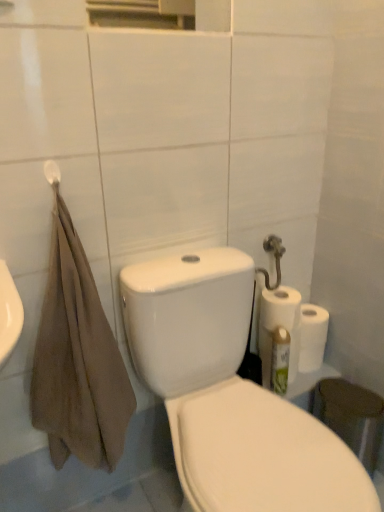
Question: Considering the positions of green matte cleaning product at right and white glossy porcelain at center in the image, is green matte cleaning product at right wider or thinner than white glossy porcelain at center?

Choices:
 (A) thin
 (B) wide

Answer: (A)

Question: From the image's perspective, relative to white glossy porcelain at center, is green matte cleaning product at right above or below?

Choices:
 (A) above
 (B) below

Answer: (A)

Question: Estimate the real-world distances between objects in this image. Which object is closer to the green matte cleaning product at right?

Choices:
 (A) brown cotton towel at left
 (B) white matte paper towel at right
 (C) white matte towel bar at upper left
 (D) white glossy porcelain at center

Answer: (B)

Question: Which object is the closest to the white matte paper towel at right?

Choices:
 (A) white glossy porcelain at center
 (B) white matte towel bar at upper left
 (C) green matte cleaning product at right
 (D) brown cotton towel at left

Answer: (C)